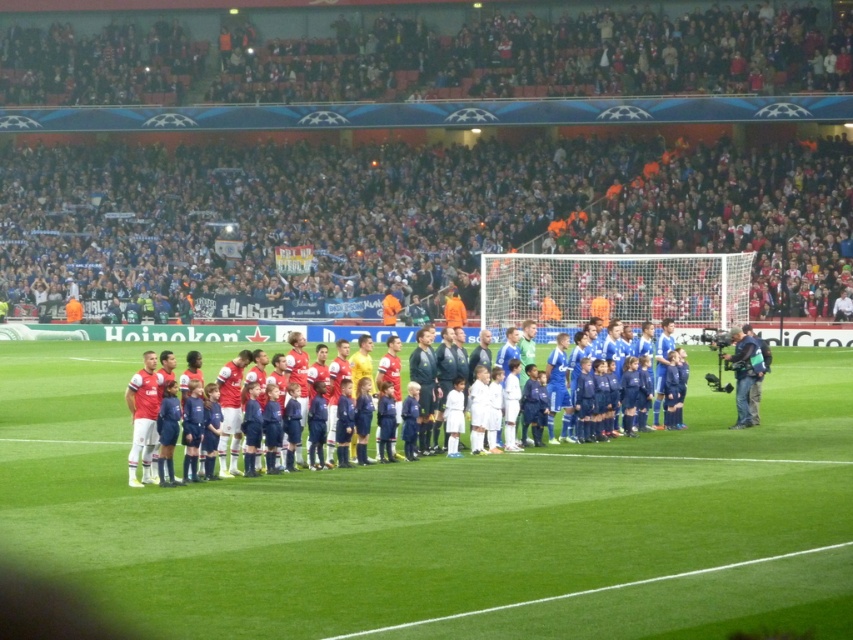
You are a photographer positioned at the center of the soccer field. You want to take a photo that includes both the point at (723, 356) and the point at (339, 397). Which point should you focus on first to ensure both are in sharp focus?

You should focus on the point at (339, 397) first because it is closer to you than the point at (723, 356), which is further away. By focusing on the closer point, the depth of field will likely include the farther point as well.

You are a photographer standing at the edge of the soccer field. You notice the black fabric camera at right and the blue fabric jersey at center. Which object is positioned lower in the image?

The black fabric camera at right is below the blue fabric jersey at center, so the black fabric camera at right is positioned lower in the image.

You are a photographer positioned at the edge of the field. You need to capture a photo that includes both the green grass football field at center and the blue fabric jersey at center. Which object should you focus on first to ensure both are in frame?

The green grass football field at center is wider than the blue fabric jersey at center, so you should focus on the green grass football field at center first to ensure both fit in the frame.